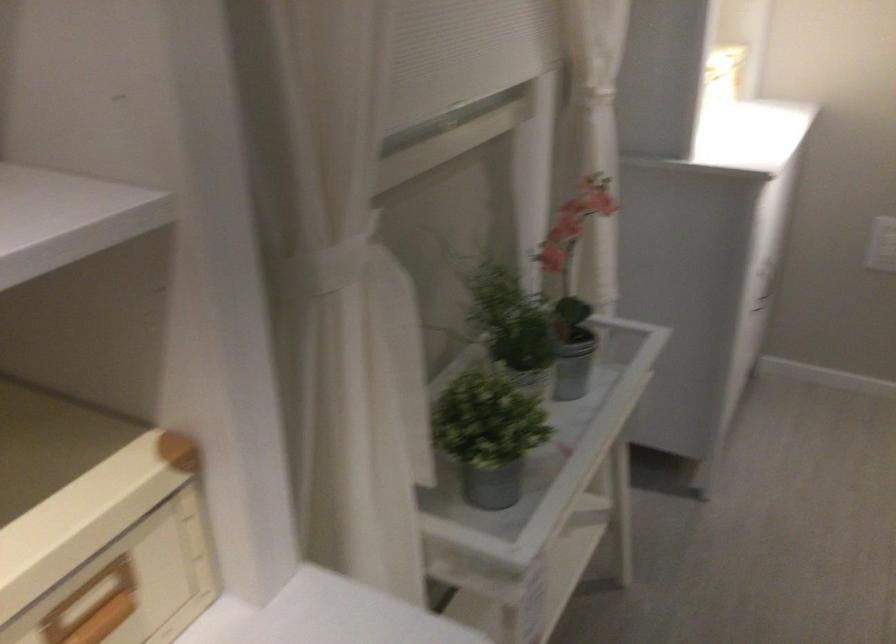
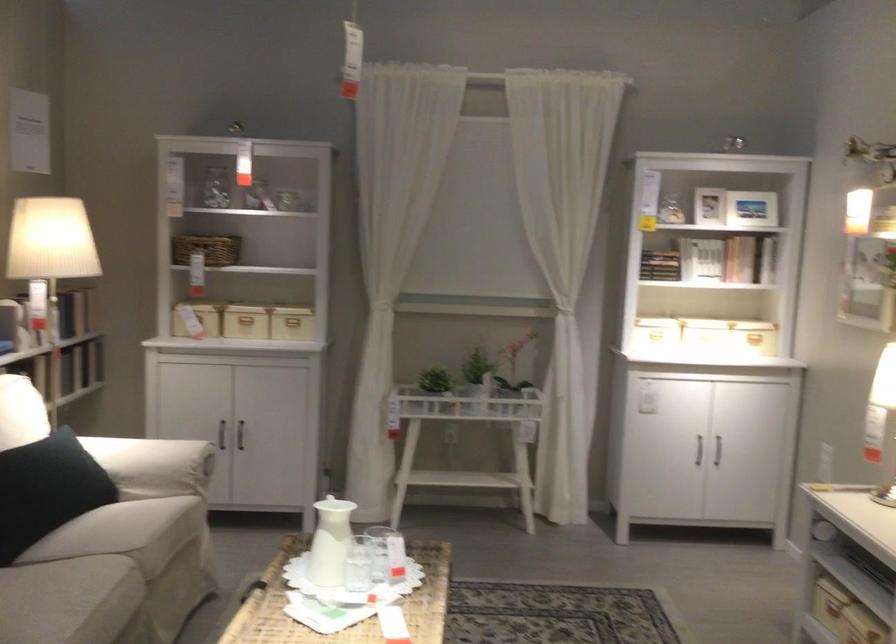
Locate, in the second image, the point that corresponds to point (784, 108) in the first image.

(755, 339)